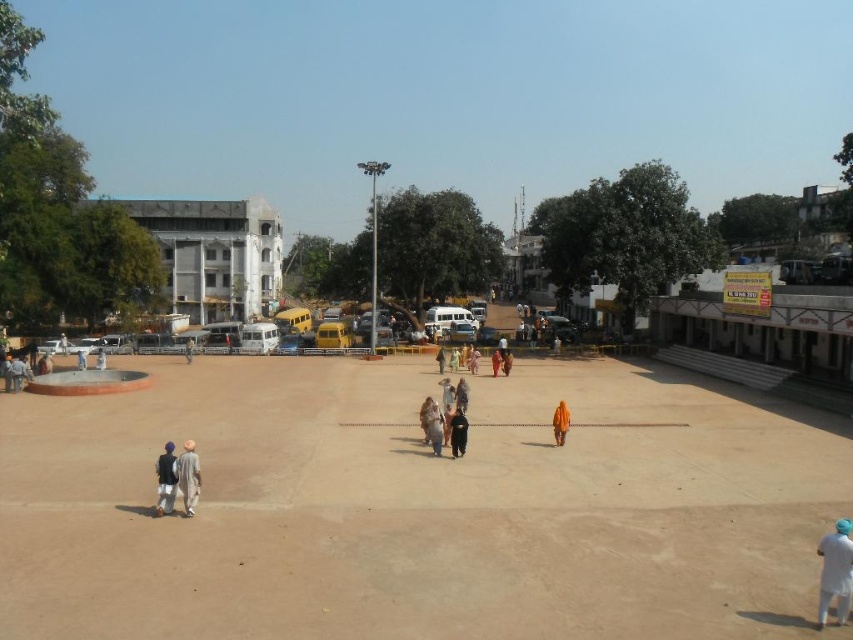
Can you confirm if light brown cotton kurta at lower left is smaller than dark brown leather bag at center?

Actually, light brown cotton kurta at lower left might be larger than dark brown leather bag at center.

Who is positioned more to the right, light brown cotton kurta at lower left or dark brown leather bag at center?

dark brown leather bag at center

Image resolution: width=853 pixels, height=640 pixels. I want to click on light brown cotton kurta at lower left, so click(x=189, y=476).

Where is `light brown cotton kurta at lower left`? light brown cotton kurta at lower left is located at coordinates (189, 476).

Is point (729, 524) positioned before point (186, 440)?

That is True.

Locate an element on the screen. brown sand at center is located at coordinates (415, 508).

Is light brown cotton kurta at lower left wider than dark blue fabric turban at lower left?

Yes.

Where is `light brown cotton kurta at lower left`? This screenshot has height=640, width=853. light brown cotton kurta at lower left is located at coordinates (189, 476).